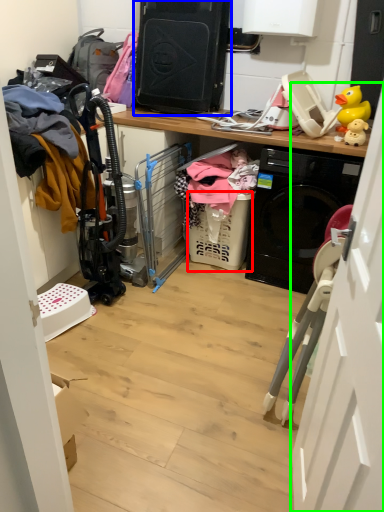
Question: Estimate the real-world distances between objects in this image. Which object is closer to basket (highlighted by a red box), appliance (highlighted by a blue box) or door (highlighted by a green box)?

Choices:
 (A) appliance
 (B) door

Answer: (A)